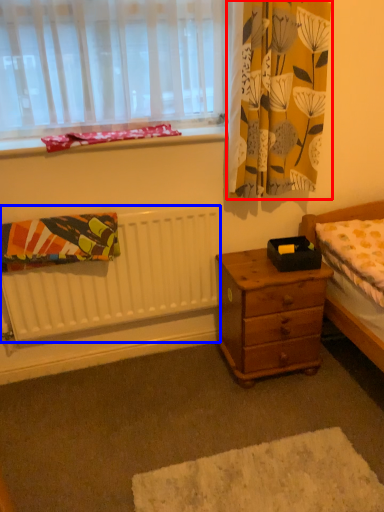
Question: Which of the following is the closest to the observer, curtain (highlighted by a red box) or radiator (highlighted by a blue box)?

Choices:
 (A) curtain
 (B) radiator

Answer: (A)